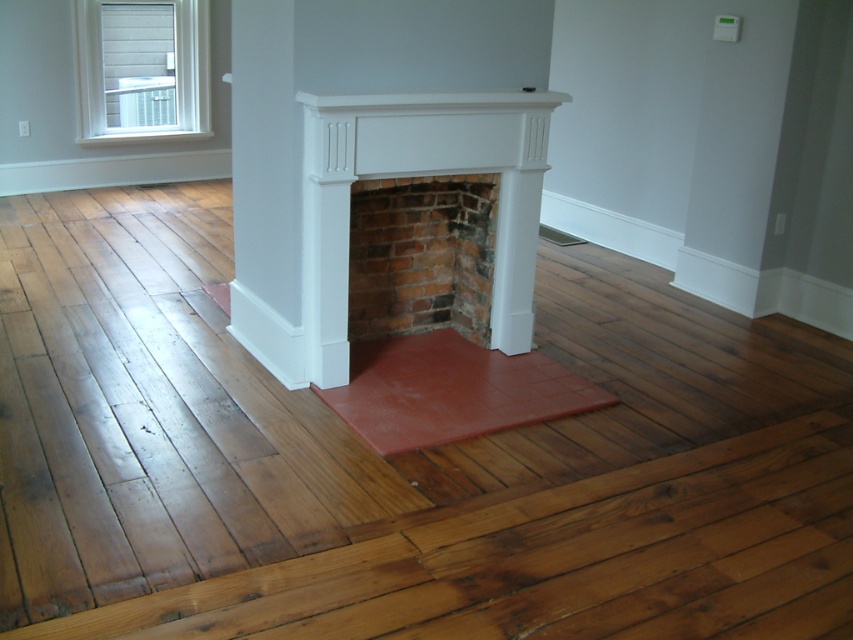
Consider the image. You are an interior designer planning to install a new lighting fixture in the living room. The fixture requires a minimum of 2.5 meters of clearance between the white painted brick fireplace at center and the white wood window at upper left. Can the existing space accommodate this requirement?

The white painted brick fireplace at center is 4.30 meters from the white wood window at upper left. Since the required clearance is 2.5 meters, the existing space can accommodate the lighting fixture as the distance is sufficient.

You are standing in the living room and want to place a new painting between the white painted brick fireplace at center and the white wood window at upper left. Based on their positions, which object should the painting be closer to?

The white painted brick fireplace at center is to the right of the white wood window at upper left, so the painting should be placed closer to the white wood window at upper left to be between them.